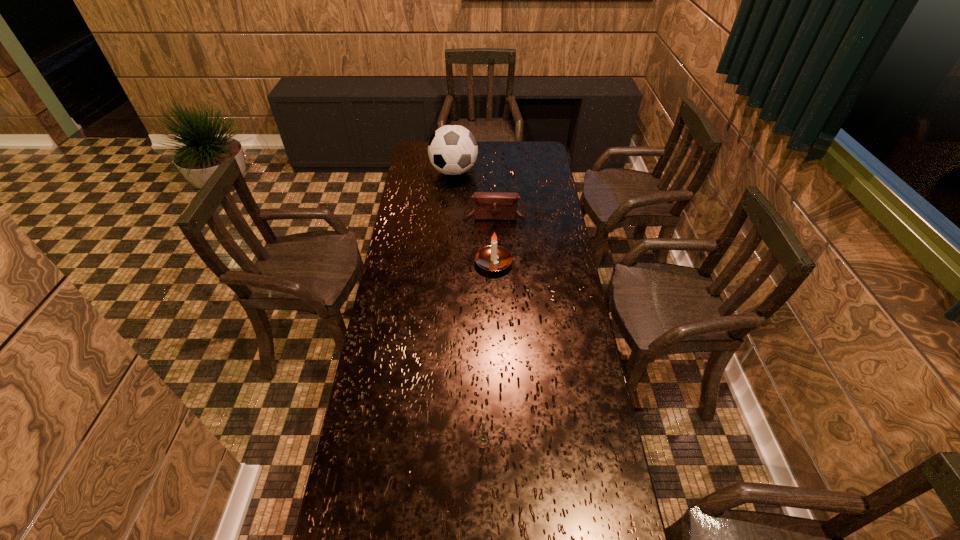
The image size is (960, 540). Identify the location of free space between the farther candle and the tallest object. (473, 218).

At what (x,y) coordinates should I click in order to perform the action: click on free spot between the farthest object and the farther candle. Please return your answer as a coordinate pair (x, y). This screenshot has height=540, width=960. Looking at the image, I should click on (473, 218).

You are a GUI agent. You are given a task and a screenshot of the screen. Output one action in this format:
    pyautogui.click(x=<x>, y=<y>)
    Task: Click on the free spot between the shoulder bag and the shorter candle
    Image resolution: width=960 pixels, height=540 pixels.
    Given the screenshot: What is the action you would take?
    pyautogui.click(x=490, y=329)

Find the location of a particular element. The image size is (960, 540). vacant space that is in between the third shortest object and the farthest object is located at coordinates (473, 218).

The image size is (960, 540). Find the location of `unoccupied position between the shoulder bag and the nearest object`. unoccupied position between the shoulder bag and the nearest object is located at coordinates (490, 329).

Identify which object is the third nearest to the soccer ball. Please provide its 2D coordinates. Your answer should be formatted as a tuple, i.e. [(x, y)], where the tuple contains the x and y coordinates of a point satisfying the conditions above.

[(483, 441)]

Identify which object is the nearest to the nearest object. Please provide its 2D coordinates. Your answer should be formatted as a tuple, i.e. [(x, y)], where the tuple contains the x and y coordinates of a point satisfying the conditions above.

[(493, 258)]

Find the location of `free region that satisfies the following two spatial constraints: 1. on the main logo of the tallest object; 2. on the left side of the nearest object`. free region that satisfies the following two spatial constraints: 1. on the main logo of the tallest object; 2. on the left side of the nearest object is located at coordinates (434, 442).

At what (x,y) coordinates should I click in order to perform the action: click on vacant position in the image that satisfies the following two spatial constraints: 1. on the main logo of the tallest object; 2. on the left side of the shorter candle. Please return your answer as a coordinate pair (x, y). The width and height of the screenshot is (960, 540). Looking at the image, I should click on point(434,442).

The image size is (960, 540). Find the location of `vacant region that satisfies the following two spatial constraints: 1. on the main logo of the third farthest object; 2. on the left side of the tallest object`. vacant region that satisfies the following two spatial constraints: 1. on the main logo of the third farthest object; 2. on the left side of the tallest object is located at coordinates (447, 263).